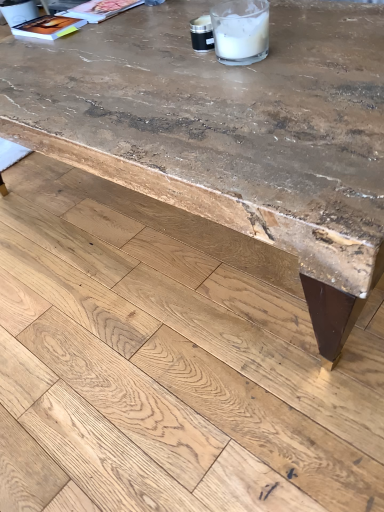
This screenshot has width=384, height=512. Describe the element at coordinates (169, 362) in the screenshot. I see `rough concrete table at upper center` at that location.

What do you see at coordinates (100, 9) in the screenshot? I see `matte paper magazine at upper left, the 1th magazine when ordered from right to left` at bounding box center [100, 9].

This screenshot has width=384, height=512. What do you see at coordinates (235, 130) in the screenshot?
I see `rustic wood table at center` at bounding box center [235, 130].

You are a GUI agent. You are given a task and a screenshot of the screen. Output one action in this format:
    pyautogui.click(x=<x>, y=<y>)
    Task: Click on the rough concrete table at upper center
    The width and height of the screenshot is (384, 512).
    Given the screenshot: What is the action you would take?
    pyautogui.click(x=169, y=362)

Consider the image. Is matte paper magazine at upper left, the second magazine from the right, wider than rustic wood table at center?

No.

Which of these two, matte paper magazine at upper left, which is counted as the 1th magazine, starting from the left, or rustic wood table at center, is smaller?

matte paper magazine at upper left, which is counted as the 1th magazine, starting from the left.

From a real-world perspective, which object stands above the other?

From a 3D spatial view, matte paper magazine at upper left, the second magazine from the right, is above.

Where is `table that is on the right side of matte paper magazine at upper left, the second magazine from the right`? This screenshot has width=384, height=512. table that is on the right side of matte paper magazine at upper left, the second magazine from the right is located at coordinates (235, 130).

Based on the photo, considering the positions of objects clear plastic straw at upper center and rustic wood table at center in the image provided, who is more to the left, clear plastic straw at upper center or rustic wood table at center?

rustic wood table at center is more to the left.

Would you say clear plastic straw at upper center is a long distance from rustic wood table at center?

No.

Is rustic wood table at center surrounded by clear plastic straw at upper center?

Actually, rustic wood table at center is outside clear plastic straw at upper center.

Would you say clear plastic straw at upper center is part of matte paper magazine at upper left, the second magazine from the right,'s contents?

No.

From a real-world perspective, is matte paper magazine at upper left, which is counted as the 1th magazine, starting from the left, physically below clear plastic straw at upper center?

Yes.

From the image's perspective, between matte paper magazine at upper left, the second magazine from the right, and clear plastic straw at upper center, who is located below?

clear plastic straw at upper center is shown below in the image.

Is matte paper magazine at upper left, the second magazine from the right, beside clear plastic straw at upper center?

There is a gap between matte paper magazine at upper left, the second magazine from the right, and clear plastic straw at upper center.

Is point (263, 145) closer to camera compared to point (89, 3)?

Yes, it is in front of point (89, 3).

Looking at this image, can we say rustic wood table at center lies outside matte paper magazine at upper left, which ranks as the second magazine in left-to-right order?

Indeed, rustic wood table at center is completely outside matte paper magazine at upper left, which ranks as the second magazine in left-to-right order.

Between rustic wood table at center and matte paper magazine at upper left, the 1th magazine when ordered from right to left, which one has smaller width?

matte paper magazine at upper left, the 1th magazine when ordered from right to left.

Could you tell me if rustic wood table at center is turned towards matte paper magazine at upper left, the 1th magazine when ordered from right to left?

No, rustic wood table at center is not turned towards matte paper magazine at upper left, the 1th magazine when ordered from right to left.

Is rough concrete table at upper center turned away from clear plastic straw at upper center?

That's not correct — rough concrete table at upper center is not looking away from clear plastic straw at upper center.

Can clear plastic straw at upper center be found inside rough concrete table at upper center?

Actually, clear plastic straw at upper center is outside rough concrete table at upper center.

Looking at this image, does rough concrete table at upper center have a lesser height compared to clear plastic straw at upper center?

Yes.

Considering the sizes of objects rough concrete table at upper center and clear plastic straw at upper center in the image provided, who is wider, rough concrete table at upper center or clear plastic straw at upper center?

rough concrete table at upper center is wider.

Can we say rough concrete table at upper center lies outside matte paper magazine at upper left, which ranks as the second magazine in left-to-right order?

Yes, rough concrete table at upper center is located beyond the bounds of matte paper magazine at upper left, which ranks as the second magazine in left-to-right order.

Are rough concrete table at upper center and matte paper magazine at upper left, which ranks as the second magazine in left-to-right order, beside each other?

rough concrete table at upper center is not next to matte paper magazine at upper left, which ranks as the second magazine in left-to-right order, and they're not touching.

In terms of width, does rough concrete table at upper center look wider or thinner when compared to matte paper magazine at upper left, the 1th magazine when ordered from right to left?

Clearly, rough concrete table at upper center has more width compared to matte paper magazine at upper left, the 1th magazine when ordered from right to left.

At what (x,y) coordinates should I click in order to perform the action: click on concrete in front of the matte paper magazine at upper left, the 1th magazine when ordered from right to left. Please return your answer as a coordinate pair (x, y). The image size is (384, 512). Looking at the image, I should click on (169, 362).

Considering the sizes of objects rustic wood table at center and rough concrete table at upper center in the image provided, who is shorter, rustic wood table at center or rough concrete table at upper center?

rough concrete table at upper center is shorter.

From a real-world perspective, is rustic wood table at center physically located above or below rough concrete table at upper center?

rustic wood table at center is above rough concrete table at upper center.

Can you confirm if rustic wood table at center is positioned to the left of rough concrete table at upper center?

No, rustic wood table at center is not to the left of rough concrete table at upper center.

In the scene shown: Would you say rustic wood table at center is inside or outside rough concrete table at upper center?

rustic wood table at center is located beyond the bounds of rough concrete table at upper center.

In order to click on the 1st magazine behind the rustic wood table at center in this screenshot , I will do `click(48, 27)`.

You are a GUI agent. You are given a task and a screenshot of the screen. Output one action in this format:
    pyautogui.click(x=<x>, y=<y>)
    Task: Click on the table in front of the clear plastic straw at upper center
    The height and width of the screenshot is (512, 384).
    Given the screenshot: What is the action you would take?
    pyautogui.click(x=235, y=130)

Estimate the real-world distances between objects in this image. Which object is closer to rough concrete table at upper center, matte paper magazine at upper left, the second magazine from the right, or rustic wood table at center?

The object closer to rough concrete table at upper center is rustic wood table at center.

Based on their spatial positions, is rough concrete table at upper center or matte paper magazine at upper left, the second magazine from the right, further from clear plastic straw at upper center?

Based on the image, rough concrete table at upper center appears to be further to clear plastic straw at upper center.

From the picture: Based on their spatial positions, is clear plastic straw at upper center or matte paper magazine at upper left, the 1th magazine when ordered from right to left, closer to rough concrete table at upper center?

Among the two, clear plastic straw at upper center is located nearer to rough concrete table at upper center.

When comparing their distances from rough concrete table at upper center, does rustic wood table at center or matte paper magazine at upper left, the 1th magazine when ordered from right to left, seem closer?

Based on the image, rustic wood table at center appears to be nearer to rough concrete table at upper center.

Based on their spatial positions, is matte paper magazine at upper left, the second magazine from the right, or matte paper magazine at upper left, which ranks as the second magazine in left-to-right order, closer to rustic wood table at center?

matte paper magazine at upper left, the second magazine from the right.

Considering their positions, is matte paper magazine at upper left, the 1th magazine when ordered from right to left, positioned closer to clear plastic straw at upper center than matte paper magazine at upper left, which is counted as the 1th magazine, starting from the left?

matte paper magazine at upper left, the 1th magazine when ordered from right to left, lies closer to clear plastic straw at upper center than the other object.

Based on their spatial positions, is rough concrete table at upper center or matte paper magazine at upper left, which is counted as the 1th magazine, starting from the left, closer to rustic wood table at center?

rough concrete table at upper center is closer to rustic wood table at center.

Based on their spatial positions, is matte paper magazine at upper left, the second magazine from the right, or clear plastic straw at upper center closer to rustic wood table at center?

The object closer to rustic wood table at center is clear plastic straw at upper center.

Where is `magazine located between rough concrete table at upper center and matte paper magazine at upper left, which ranks as the second magazine in left-to-right order, in the depth direction`? The width and height of the screenshot is (384, 512). magazine located between rough concrete table at upper center and matte paper magazine at upper left, which ranks as the second magazine in left-to-right order, in the depth direction is located at coordinates (48, 27).

I want to click on magazine situated between matte paper magazine at upper left, the second magazine from the right, and clear plastic straw at upper center from left to right, so click(x=100, y=9).

This screenshot has height=512, width=384. Identify the location of drinking straw located between rustic wood table at center and matte paper magazine at upper left, which ranks as the second magazine in left-to-right order, in the depth direction. pyautogui.click(x=241, y=31).

Where is `table between rough concrete table at upper center and matte paper magazine at upper left, which ranks as the second magazine in left-to-right order, from front to back`? The height and width of the screenshot is (512, 384). table between rough concrete table at upper center and matte paper magazine at upper left, which ranks as the second magazine in left-to-right order, from front to back is located at coordinates (235, 130).